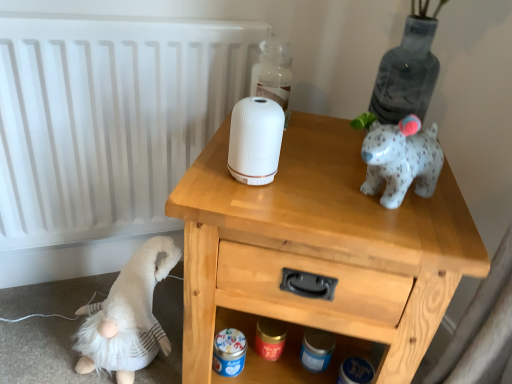
Where is `vacant area that is in front of white matte speaker at center`? The width and height of the screenshot is (512, 384). vacant area that is in front of white matte speaker at center is located at coordinates click(247, 204).